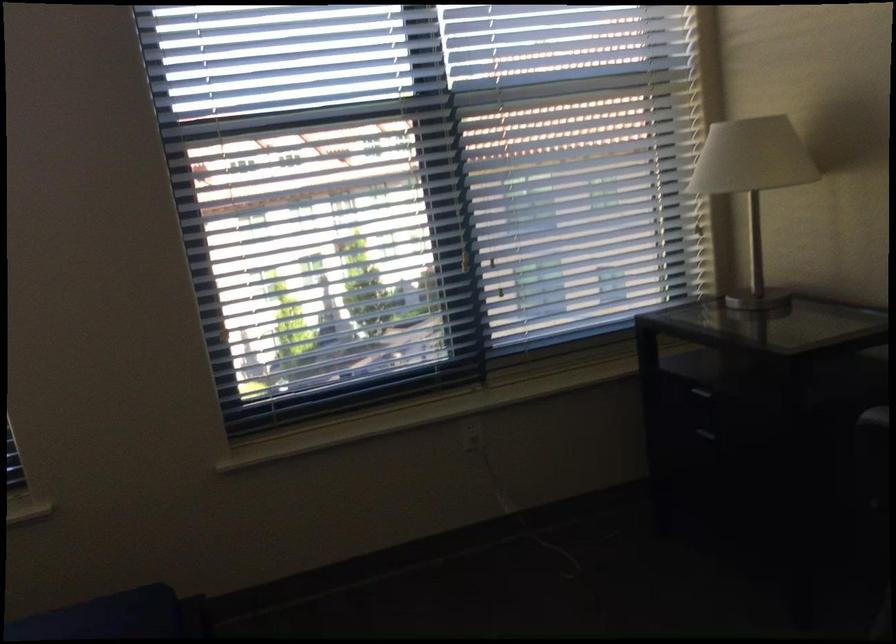
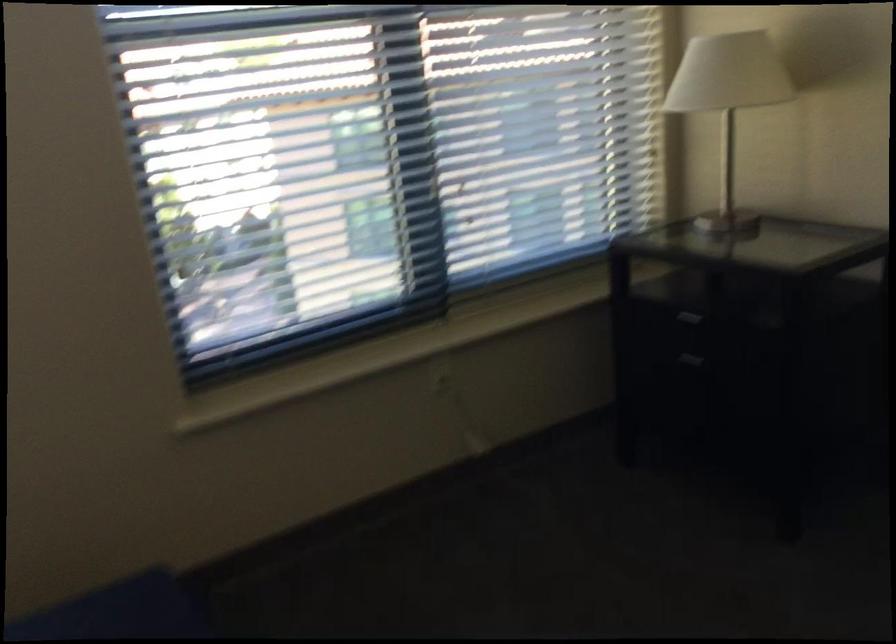
In the second image, find the point that corresponds to the point at 745,180 in the first image.

(728, 102)